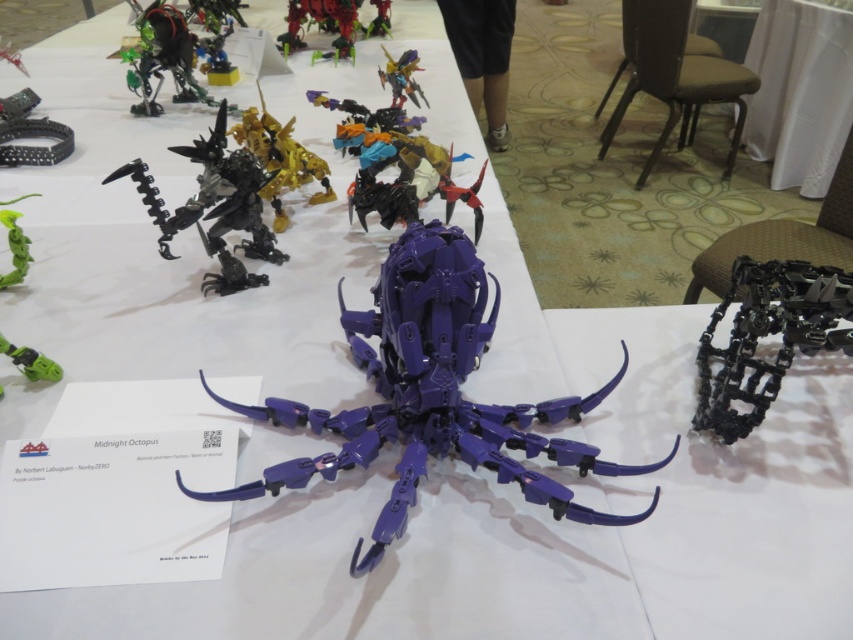
Can you confirm if black metallic chain at center is positioned above metallic blue robot at upper center?

No, black metallic chain at center is not above metallic blue robot at upper center.

Is black metallic chain at center below metallic blue robot at upper center?

Yes.

The image size is (853, 640). What do you see at coordinates (767, 333) in the screenshot?
I see `black metallic chain at center` at bounding box center [767, 333].

Identify the location of black metallic chain at center. This screenshot has width=853, height=640. (767, 333).

Which is in front, point (252, 244) or point (1, 346)?

Point (1, 346)

Is point (265, 227) in front of point (27, 349)?

That is False.

Image resolution: width=853 pixels, height=640 pixels. I want to click on black matte scorpion at upper left, so click(x=215, y=208).

Is shiny black robot at upper left smaller than metallic green robot at upper center?

Actually, shiny black robot at upper left might be larger than metallic green robot at upper center.

Is shiny black robot at upper left above metallic green robot at upper center?

Incorrect, shiny black robot at upper left is not positioned above metallic green robot at upper center.

You are a GUI agent. You are given a task and a screenshot of the screen. Output one action in this format:
    pyautogui.click(x=<x>, y=<y>)
    Task: Click on the shiny black robot at upper left
    The height and width of the screenshot is (640, 853).
    Given the screenshot: What is the action you would take?
    pyautogui.click(x=161, y=58)